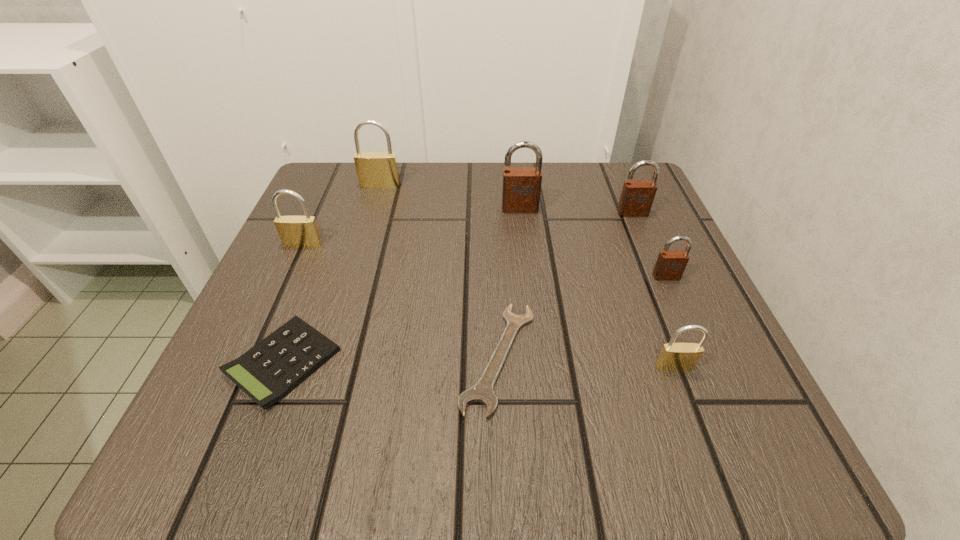
Identify the location of unoccupied area between the biggest brown padlock and the fourth nearest object. The image size is (960, 540). (593, 242).

Image resolution: width=960 pixels, height=540 pixels. What are the coordinates of `free space between the leftmost padlock and the seventh tallest object` in the screenshot? It's located at (293, 303).

The width and height of the screenshot is (960, 540). I want to click on unoccupied area between the rightmost brass padlock and the calculator, so click(479, 364).

At what (x,y) coordinates should I click in order to perform the action: click on vacant point located between the second smallest brown padlock and the second nearest padlock. Please return your answer as a coordinate pair (x, y). Looking at the image, I should click on (649, 245).

Locate which object ranks seventh in proximity to the second farthest brass padlock. Please provide its 2D coordinates. Your answer should be formatted as a tuple, i.e. [(x, y)], where the tuple contains the x and y coordinates of a point satisfying the conditions above.

[(674, 356)]

Identify the location of object that is the closest to the second padlock from left to right. (294, 231).

Select which padlock is the fourth closest to the wrench. Please provide its 2D coordinates. Your answer should be formatted as a tuple, i.e. [(x, y)], where the tuple contains the x and y coordinates of a point satisfying the conditions above.

[(294, 231)]

Where is `padlock that is the second closest to the calculator`? The height and width of the screenshot is (540, 960). padlock that is the second closest to the calculator is located at coordinates (374, 169).

Locate an element on the screen. brass padlock that stands as the closest to the fourth farthest object is located at coordinates (374, 169).

Locate an element on the screen. The width and height of the screenshot is (960, 540). the second closest brass padlock relative to the second shortest object is located at coordinates (374, 169).